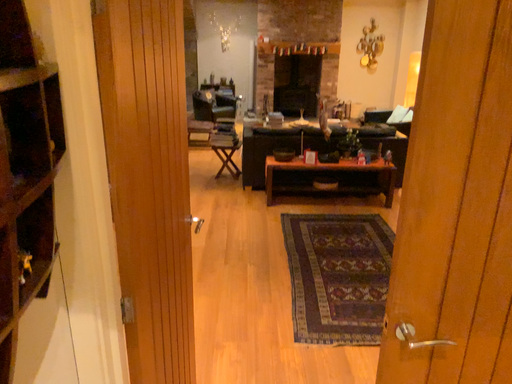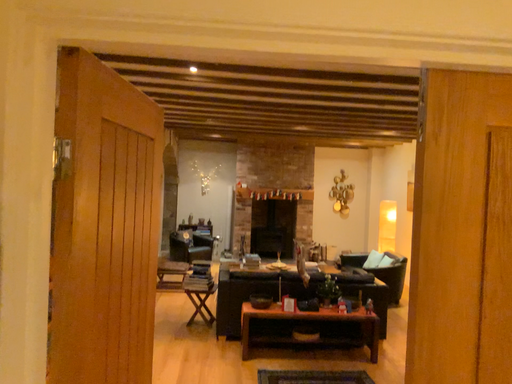
Question: Which way did the camera rotate in the video?

Choices:
 (A) rotated upward
 (B) rotated downward

Answer: (A)